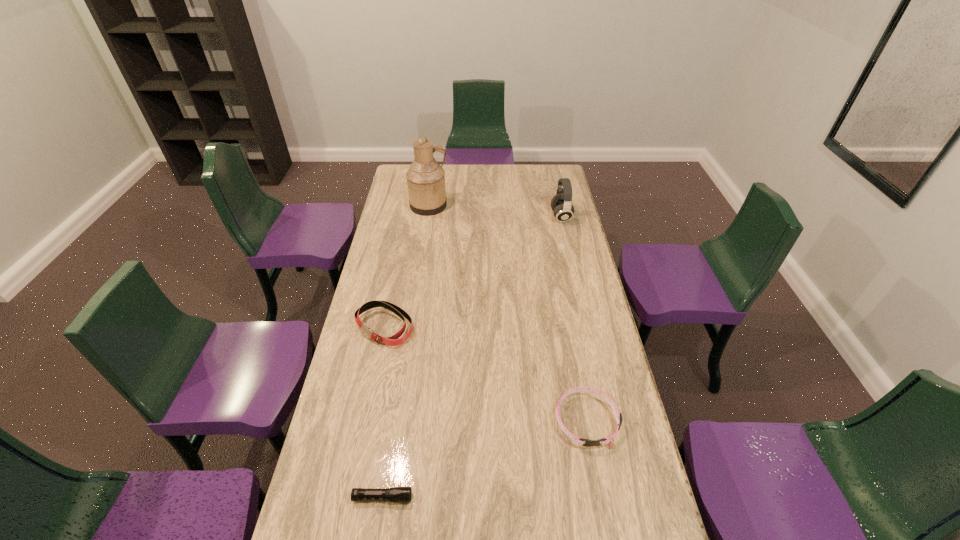
The image size is (960, 540). Identify the location of unoccupied area between the nearest object and the third shortest object. (383, 412).

Where is `vacant area that lies between the left dog collar and the tallest object`? The image size is (960, 540). vacant area that lies between the left dog collar and the tallest object is located at coordinates (407, 266).

Identify the location of vacant area between the flashlight and the fourth tallest object. (485, 459).

The width and height of the screenshot is (960, 540). I want to click on the second closest object relative to the nearest object, so [393, 340].

At what (x,y) coordinates should I click in order to perform the action: click on object that ranks as the fourth closest to the right dog collar. Please return your answer as a coordinate pair (x, y). Image resolution: width=960 pixels, height=540 pixels. Looking at the image, I should click on (425, 178).

The height and width of the screenshot is (540, 960). I want to click on free location that satisfies the following two spatial constraints: 1. on the ear cups of the fourth shortest object; 2. on the front side of the taller dog collar, so (x=587, y=326).

Where is `vacant point that satisfies the following two spatial constraints: 1. on the ear cups of the second tallest object; 2. on the front side of the third tallest object`? The image size is (960, 540). vacant point that satisfies the following two spatial constraints: 1. on the ear cups of the second tallest object; 2. on the front side of the third tallest object is located at coordinates [587, 326].

In order to click on free location that satisfies the following two spatial constraints: 1. on the ear cups of the second tallest object; 2. with the buckle on the fourth farthest object in this screenshot , I will do `click(608, 421)`.